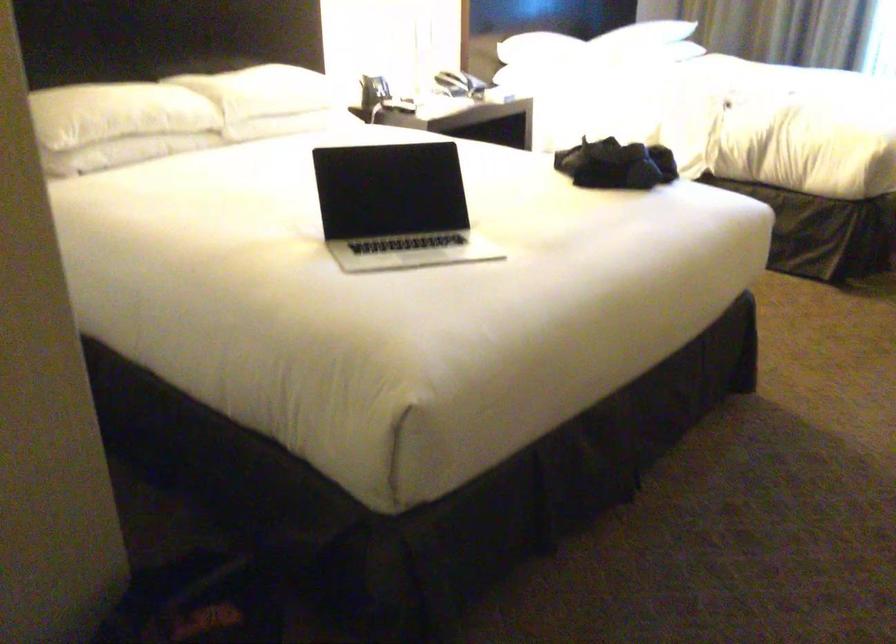
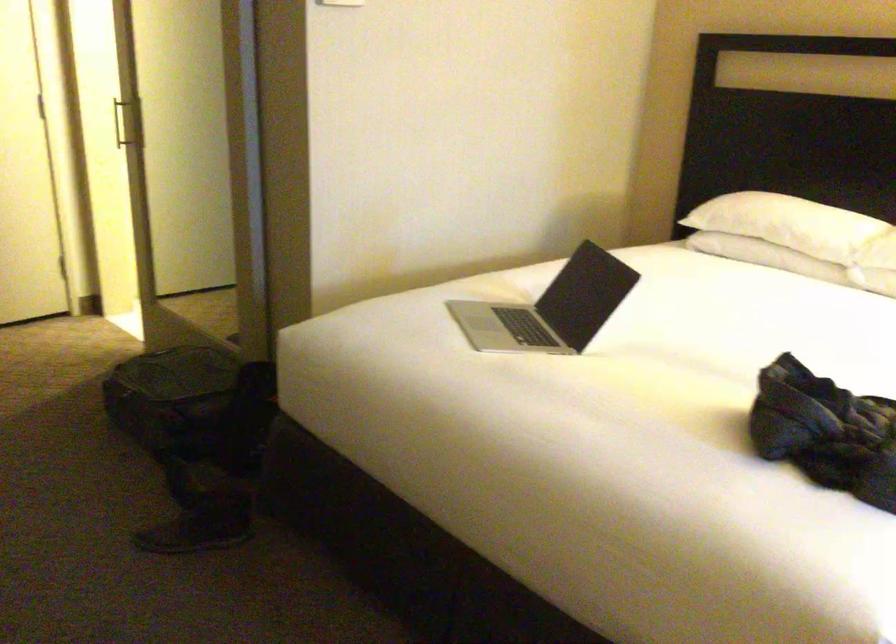
Locate, in the second image, the point that corresponds to (192,113) in the first image.

(788, 223)